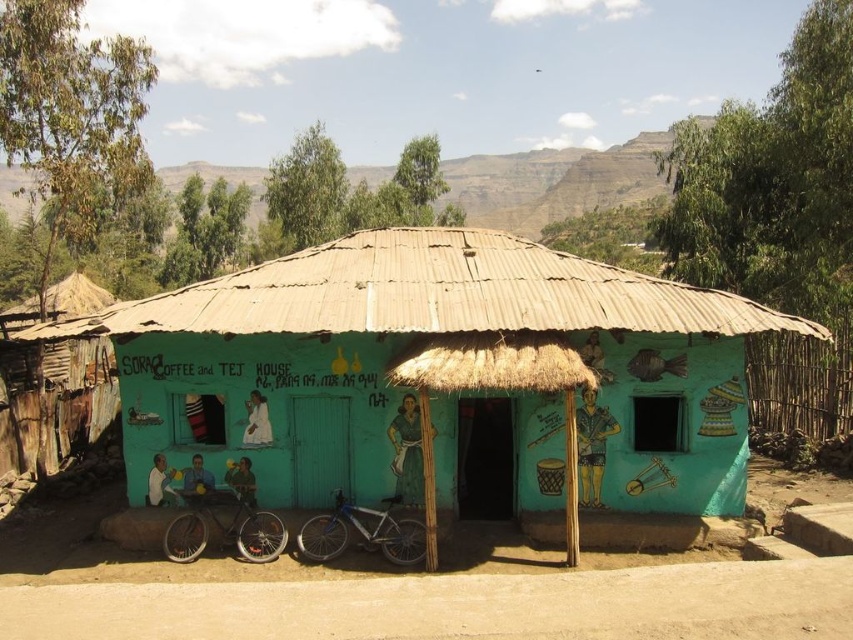
You are a GUI agent. You are given a task and a screenshot of the screen. Output one action in this format:
    pyautogui.click(x=<x>, y=<y>)
    Task: Click on the brown thatch roof at center
    This screenshot has width=853, height=640.
    Given the screenshot: What is the action you would take?
    pyautogui.click(x=433, y=292)

What do you see at coordinates (433, 292) in the screenshot?
I see `brown thatch roof at center` at bounding box center [433, 292].

Which is behind, point (184, 326) or point (392, 561)?

Positioned behind is point (392, 561).

You are a GUI agent. You are given a task and a screenshot of the screen. Output one action in this format:
    pyautogui.click(x=<x>, y=<y>)
    Task: Click on the brown thatch roof at center
    The width and height of the screenshot is (853, 640).
    Given the screenshot: What is the action you would take?
    433,292

Between brown sandy dirt at lower center and shiny metallic bicycle at lower left, which one appears on the right side from the viewer's perspective?

brown sandy dirt at lower center is more to the right.

Is point (347, 614) behind point (264, 518)?

No, it is in front of (264, 518).

The image size is (853, 640). I want to click on brown sandy dirt at lower center, so click(457, 605).

Find the location of a particular element. brown sandy dirt at lower center is located at coordinates (457, 605).

Measure the distance between teal painted hut at center and shiny metallic bicycle at lower left.

A distance of 2.66 meters exists between teal painted hut at center and shiny metallic bicycle at lower left.

Between teal painted hut at center and shiny metallic bicycle at lower left, which one is positioned higher?

teal painted hut at center

Locate an element on the screen. teal painted hut at center is located at coordinates (447, 376).